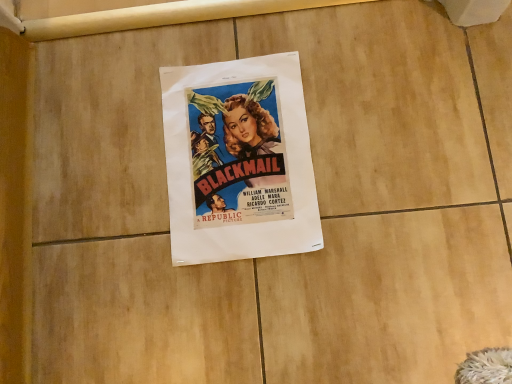
Describe the element at coordinates (239, 160) in the screenshot. This screenshot has width=512, height=384. I see `matte paper poster at center` at that location.

What are the coordinates of `matte paper poster at center` in the screenshot? It's located at (239, 160).

This screenshot has height=384, width=512. Identify the location of matte paper poster at center. (239, 160).